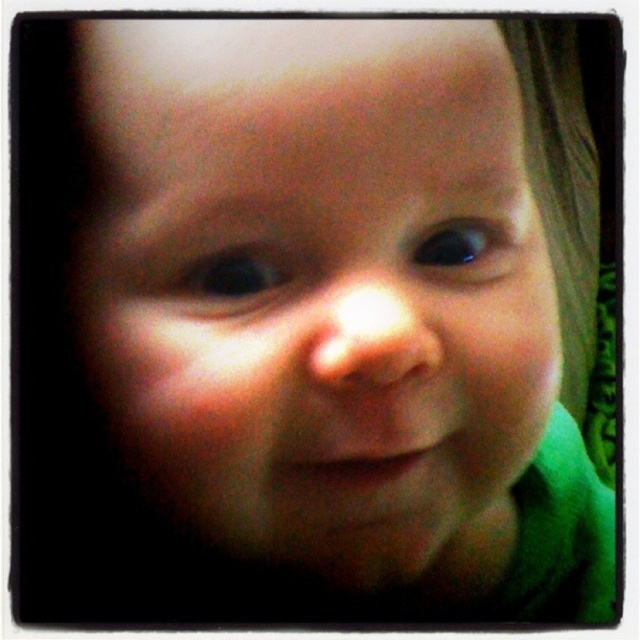
Question: Estimate the real-world distances between objects in this image. Which object is closer to the blue glossy eye at center?

Choices:
 (A) smooth skin baby at center
 (B) black glossy eye at center

Answer: (A)

Question: Does smooth skin baby at center have a lesser width compared to blue glossy eye at center?

Choices:
 (A) no
 (B) yes

Answer: (A)

Question: Can you confirm if smooth skin baby at center is wider than black glossy eye at center?

Choices:
 (A) yes
 (B) no

Answer: (A)

Question: Does smooth skin baby at center have a greater width compared to black glossy eye at center?

Choices:
 (A) yes
 (B) no

Answer: (A)

Question: Which of the following is the closest to the observer?

Choices:
 (A) blue glossy eye at center
 (B) black glossy eye at center
 (C) smooth skin baby at center

Answer: (C)

Question: Which object is the farthest from the blue glossy eye at center?

Choices:
 (A) smooth skin baby at center
 (B) black glossy eye at center

Answer: (B)